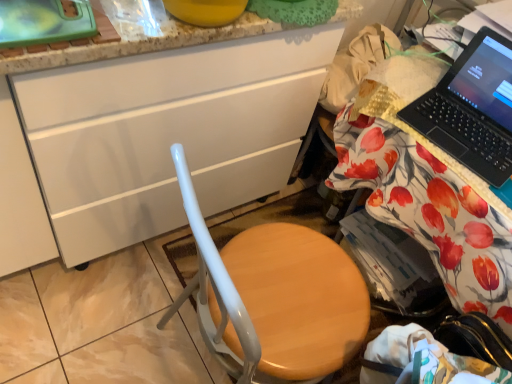
Question: From a real-world perspective, is white glossy cabinet at center below wooden desk at right?

Choices:
 (A) no
 (B) yes

Answer: (A)

Question: Considering the relative positions of white glossy cabinet at center and wooden desk at right in the image provided, is white glossy cabinet at center to the left of wooden desk at right from the viewer's perspective?

Choices:
 (A) no
 (B) yes

Answer: (B)

Question: Does white glossy cabinet at center appear on the right side of wooden desk at right?

Choices:
 (A) no
 (B) yes

Answer: (A)

Question: Does white glossy cabinet at center have a lesser width compared to wooden desk at right?

Choices:
 (A) yes
 (B) no

Answer: (A)

Question: Is white glossy cabinet at center behind wooden desk at right?

Choices:
 (A) yes
 (B) no

Answer: (B)

Question: From a real-world perspective, is wooden seat at center positioned above or below black plastic laptop at upper right?

Choices:
 (A) below
 (B) above

Answer: (A)

Question: In the image, is wooden seat at center positioned in front of or behind black plastic laptop at upper right?

Choices:
 (A) behind
 (B) front

Answer: (B)

Question: Considering the positions of wooden seat at center and black plastic laptop at upper right in the image, is wooden seat at center bigger or smaller than black plastic laptop at upper right?

Choices:
 (A) big
 (B) small

Answer: (A)

Question: From their relative heights in the image, would you say wooden seat at center is taller or shorter than black plastic laptop at upper right?

Choices:
 (A) short
 (B) tall

Answer: (B)

Question: From a real-world perspective, is black plastic laptop at upper right physically located above or below white glossy cabinet at center?

Choices:
 (A) below
 (B) above

Answer: (B)

Question: Visually, is black plastic laptop at upper right positioned to the left or to the right of white glossy cabinet at center?

Choices:
 (A) right
 (B) left

Answer: (A)

Question: Considering the positions of black plastic laptop at upper right and white glossy cabinet at center in the image, is black plastic laptop at upper right bigger or smaller than white glossy cabinet at center?

Choices:
 (A) big
 (B) small

Answer: (B)

Question: In terms of height, does black plastic laptop at upper right look taller or shorter compared to white glossy cabinet at center?

Choices:
 (A) short
 (B) tall

Answer: (A)

Question: Is wooden desk at right in front of or behind wooden seat at center in the image?

Choices:
 (A) behind
 (B) front

Answer: (A)

Question: Based on their sizes in the image, would you say wooden desk at right is bigger or smaller than wooden seat at center?

Choices:
 (A) big
 (B) small

Answer: (A)